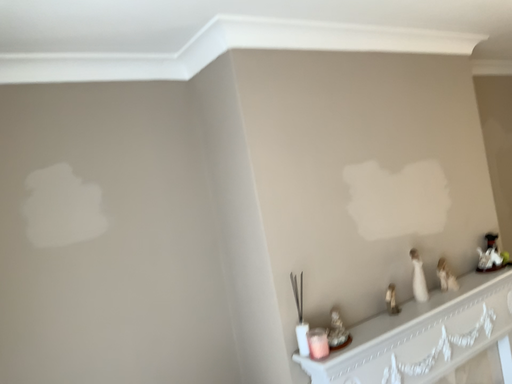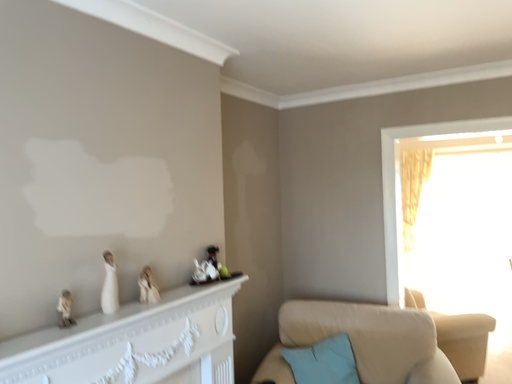
Question: How did the camera likely rotate when shooting the video?

Choices:
 (A) rotated right
 (B) rotated left

Answer: (A)